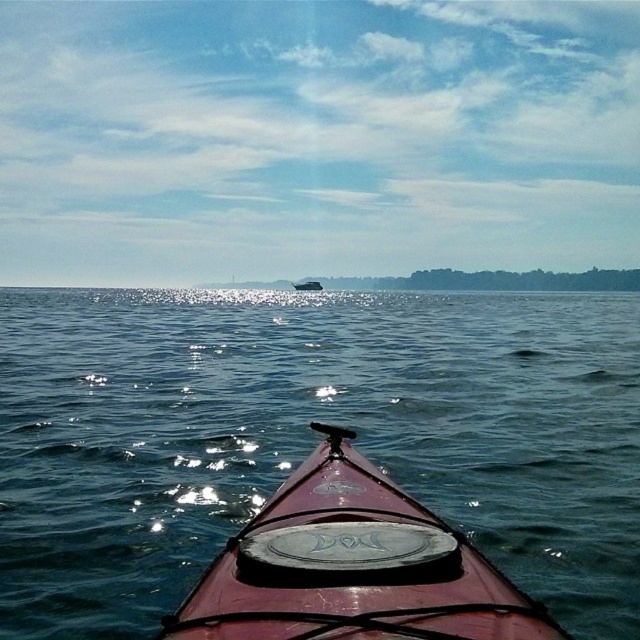
Does shiny red kayak at center have a lesser height compared to metallic silver boat at center?

Yes.

Which is behind, point (292, 602) or point (304, 285)?

Positioned behind is point (304, 285).

The image size is (640, 640). Identify the location of shiny red kayak at center. (353, 566).

Does glossy water at center have a lesser height compared to shiny red kayak at center?

In fact, glossy water at center may be taller than shiny red kayak at center.

Does glossy water at center have a smaller size compared to shiny red kayak at center?

No, glossy water at center is not smaller than shiny red kayak at center.

Looking at this image, who is more distant from viewer, (392, 465) or (230, 632)?

The point (392, 465) is behind.

Where is `glossy water at center`? This screenshot has width=640, height=640. glossy water at center is located at coordinates (308, 436).

Consider the image. Does glossy water at center appear under metallic silver boat at center?

Yes, glossy water at center is below metallic silver boat at center.

At what (x,y) coordinates should I click in order to perform the action: click on glossy water at center. Please return your answer as a coordinate pair (x, y). The width and height of the screenshot is (640, 640). Looking at the image, I should click on (308, 436).

The width and height of the screenshot is (640, 640). Find the location of `glossy water at center`. glossy water at center is located at coordinates (308, 436).